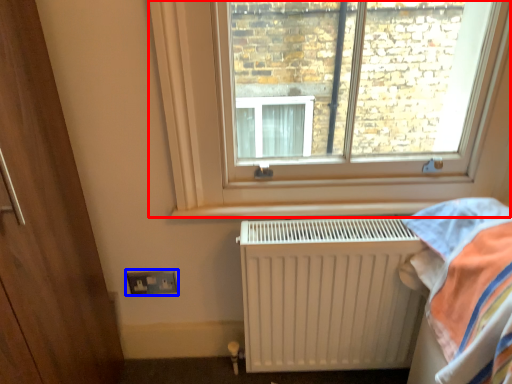
Question: Which point is further to the camera, window (highlighted by a red box) or electric outlet (highlighted by a blue box)?

Choices:
 (A) window
 (B) electric outlet

Answer: (B)